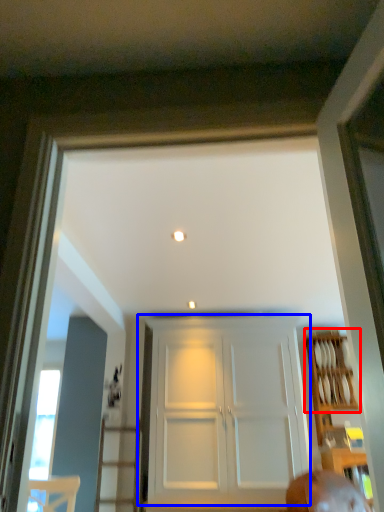
Question: Which of the following is the farthest to the observer, shelf (highlighted by a red box) or door (highlighted by a blue box)?

Choices:
 (A) shelf
 (B) door

Answer: (A)